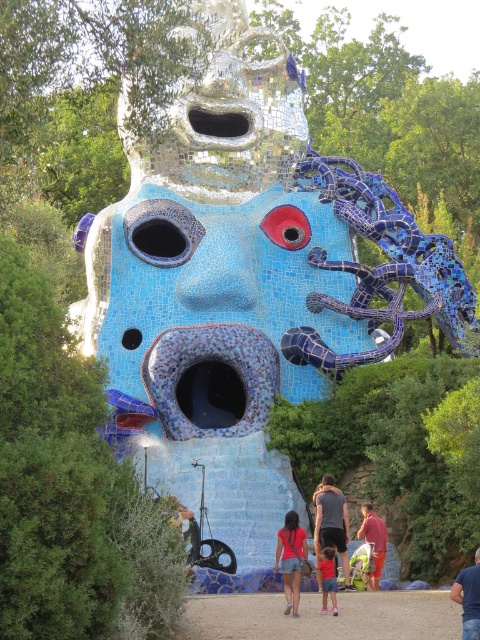
Question: Among these points, which one is nearest to the camera?

Choices:
 (A) (324, 595)
 (B) (319, 532)
 (C) (187, 237)
 (D) (296, 241)

Answer: (A)

Question: From the image, what is the correct spatial relationship of red fabric bag at lower center in relation to matte blue shorts at center?

Choices:
 (A) left
 (B) right

Answer: (B)

Question: Is matte blue mosaic eye at center to the right of red fabric bag at lower center from the viewer's perspective?

Choices:
 (A) no
 (B) yes

Answer: (A)

Question: Does blue fabric at center have a lesser width compared to red fabric bag at lower center?

Choices:
 (A) no
 (B) yes

Answer: (A)

Question: Which point appears closest to the camera in this image?

Choices:
 (A) (324, 611)
 (B) (307, 220)
 (C) (465, 618)

Answer: (C)

Question: Which point is closer to the camera taking this photo?

Choices:
 (A) (224, 122)
 (B) (286, 518)
 (C) (300, 234)

Answer: (B)